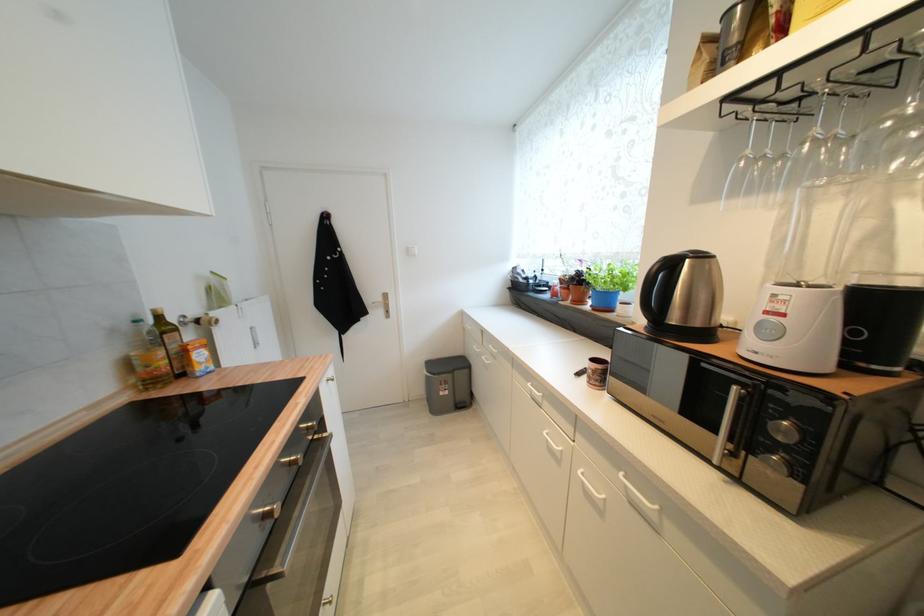
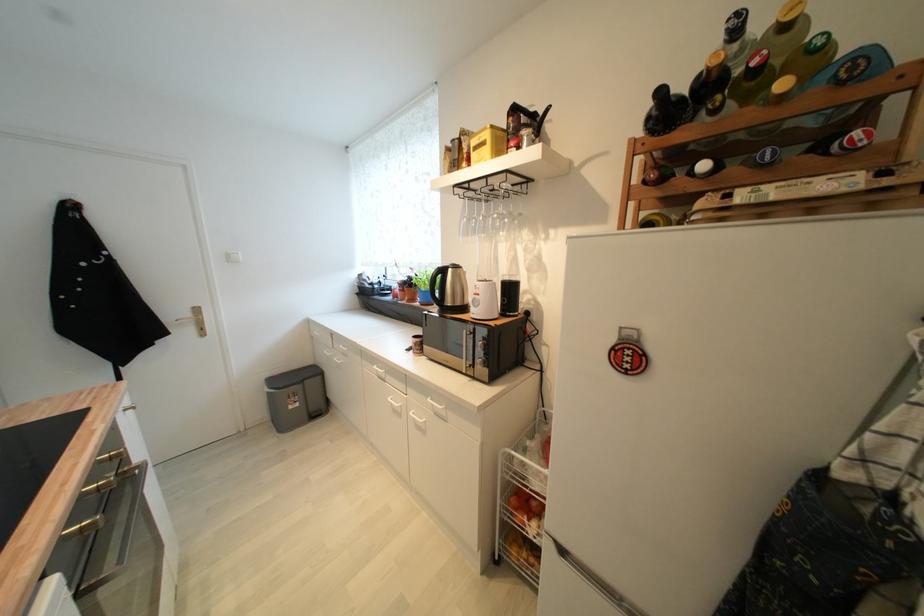
Find the pixel in the second image that matches the point at 721,464 in the first image.

(469, 374)